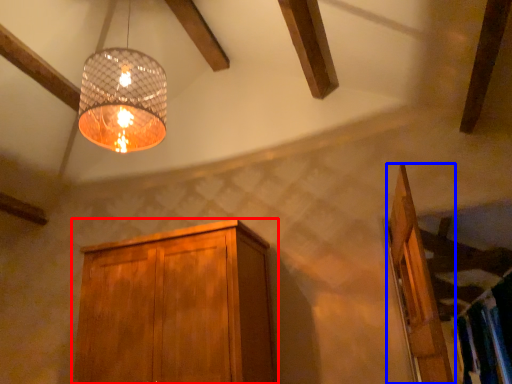
Question: Which object is closer to the camera taking this photo, cabinetry (highlighted by a red box) or door (highlighted by a blue box)?

Choices:
 (A) cabinetry
 (B) door

Answer: (B)